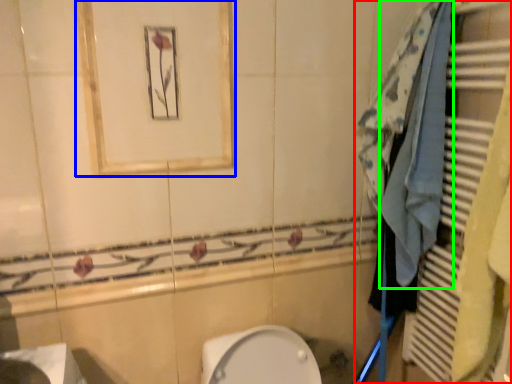
Question: Which object is the closest to the closet (highlighted by a red box)? Choose among these: medicine cabinet (highlighted by a blue box) or bath towel (highlighted by a green box).

Choices:
 (A) medicine cabinet
 (B) bath towel

Answer: (B)